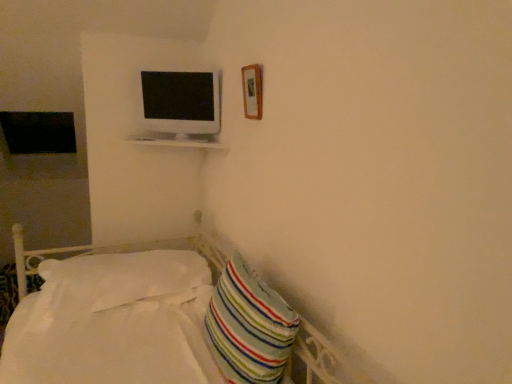
Find the location of a particular element. Image resolution: width=512 pixels, height=384 pixels. vacant area situated below white glossy monitor at upper center (from a real-world perspective) is located at coordinates (175, 142).